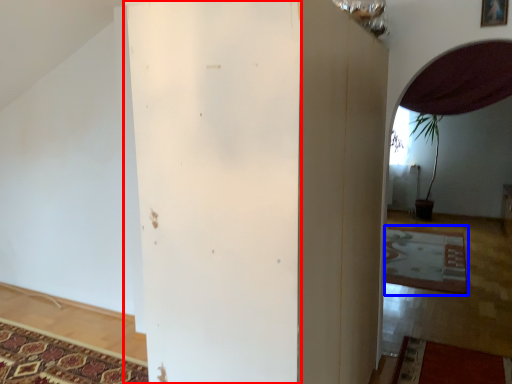
Question: Among these objects, which one is nearest to the camera, pillar (highlighted by a red box) or mat (highlighted by a blue box)?

Choices:
 (A) pillar
 (B) mat

Answer: (A)